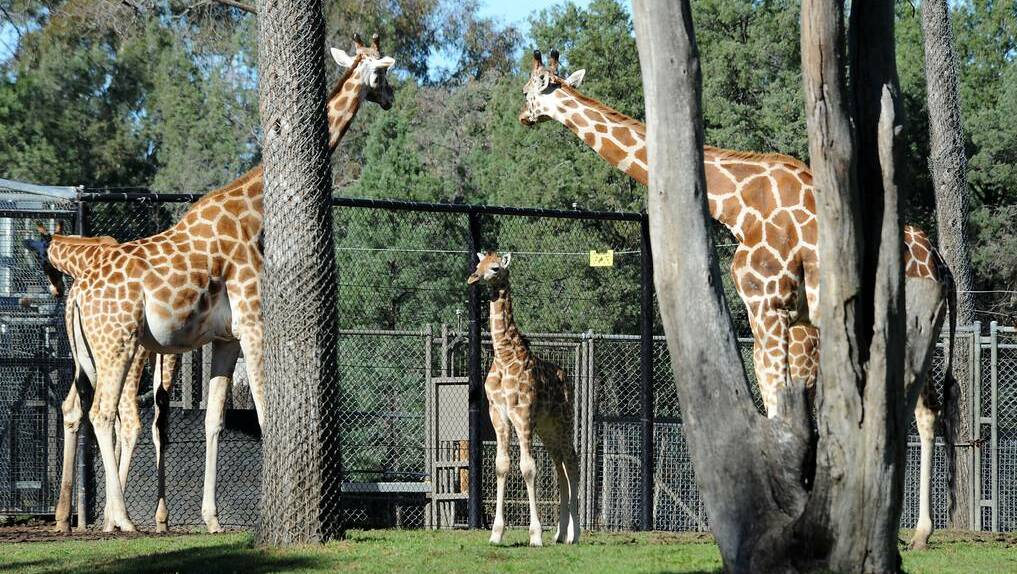
The image size is (1017, 574). I want to click on box, so click(x=440, y=400).